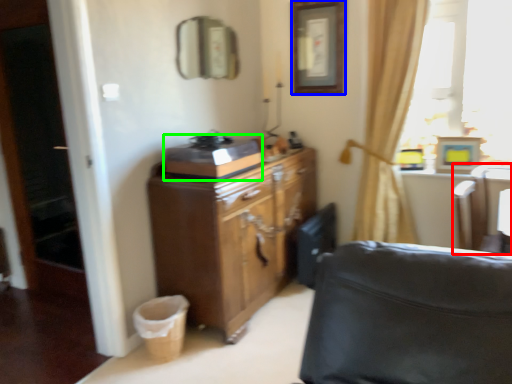
Question: Based on their relative distances, which object is nearer to swivel chair (highlighted by a red box)? Choose from picture frame (highlighted by a blue box) and appliance (highlighted by a green box).

Choices:
 (A) picture frame
 (B) appliance

Answer: (A)